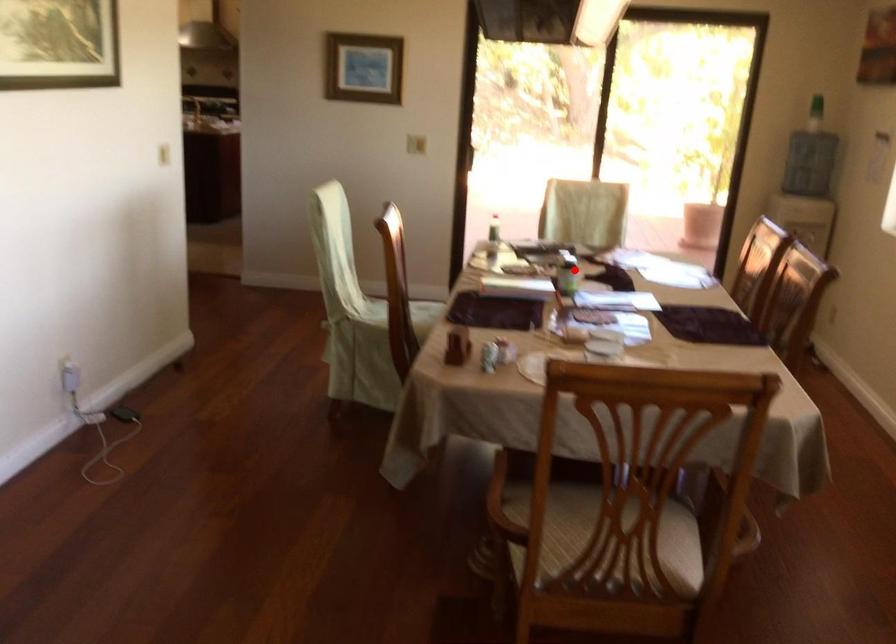
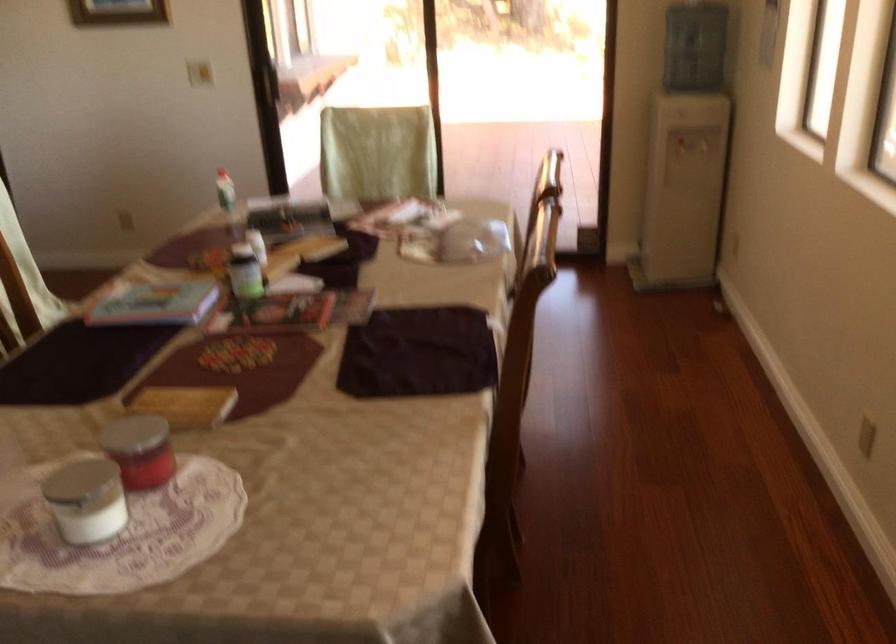
Question: I am providing you with two images of the same scene from different viewpoints. A red point is marked on the first image. Is the red point's position out of view in image 2?

Choices:
 (A) Yes
 (B) No

Answer: (B)